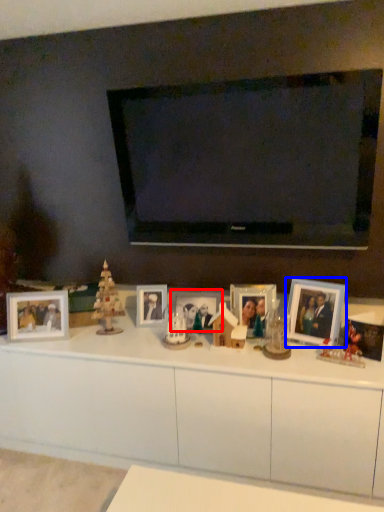
Question: Which object appears farthest to the camera in this image, picture frame (highlighted by a red box) or picture frame (highlighted by a blue box)?

Choices:
 (A) picture frame
 (B) picture frame

Answer: (A)